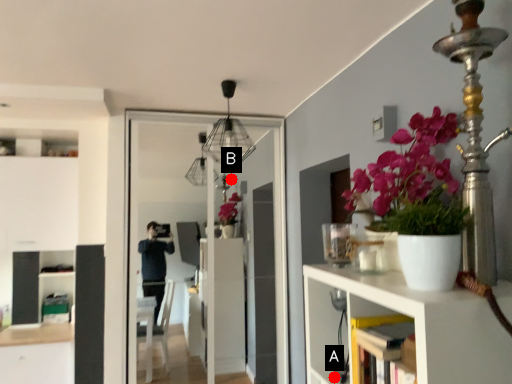
Question: Two points are circled on the image, labeled by A and B beside each circle. Which point appears farthest from the camera in this image?

Choices:
 (A) A is further
 (B) B is further

Answer: (B)